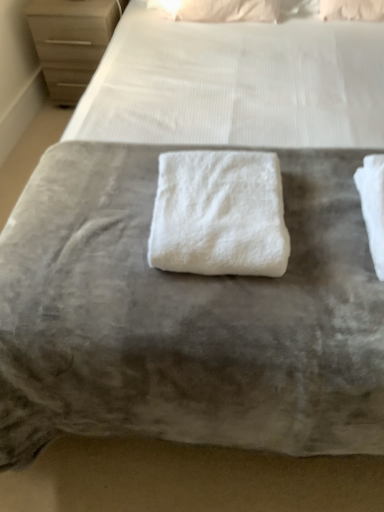
What are the coordinates of `matte wood chest of drawers at upper left` in the screenshot? It's located at (71, 41).

Identify the location of white fluffy towel at center. The height and width of the screenshot is (512, 384). (219, 214).

Measure the distance between point (289,240) and camera.

The depth of point (289,240) is 1.02 meters.

Where is `matte wood chest of drawers at upper left`? matte wood chest of drawers at upper left is located at coordinates (71, 41).

Are white fluffy towel at center and white soft pillow at upper center located far from each other?

white fluffy towel at center is far away from white soft pillow at upper center.

From a real-world perspective, between white fluffy towel at center and white soft pillow at upper center, who is vertically higher?

white fluffy towel at center, from a real-world perspective.

Consider the image. Can you confirm if white fluffy towel at center is wider than white soft pillow at upper center?

Indeed, white fluffy towel at center has a greater width compared to white soft pillow at upper center.

The image size is (384, 512). Find the location of `pillow behind the white fluffy towel at center`. pillow behind the white fluffy towel at center is located at coordinates (218, 10).

Is matte wood chest of drawers at upper left completely or partially inside white fluffy towel at center?

No, matte wood chest of drawers at upper left is not inside white fluffy towel at center.

Find the location of `chest of drawers above the white fluffy towel at center (from the image's perspective)`. chest of drawers above the white fluffy towel at center (from the image's perspective) is located at coordinates (71, 41).

From the image's perspective, which object appears higher, white soft pillow at upper center or matte wood chest of drawers at upper left?

white soft pillow at upper center appears higher in the image.

Can you tell me how much white soft pillow at upper center and matte wood chest of drawers at upper left differ in facing direction?

The angle between the facing direction of white soft pillow at upper center and the facing direction of matte wood chest of drawers at upper left is 7.36 degrees.

Is white soft pillow at upper center looking in the opposite direction of matte wood chest of drawers at upper left?

That's not correct — white soft pillow at upper center is not looking away from matte wood chest of drawers at upper left.

Is point (192, 20) closer to viewer compared to point (101, 28)?

Yes, point (192, 20) is closer to viewer.

Which is closer to the camera, (x=88, y=29) or (x=180, y=1)?

Point (x=180, y=1)

Considering the relative sizes of matte wood chest of drawers at upper left and white soft pillow at upper center in the image provided, is matte wood chest of drawers at upper left smaller than white soft pillow at upper center?

Actually, matte wood chest of drawers at upper left might be larger than white soft pillow at upper center.

Relative to white soft pillow at upper center, is matte wood chest of drawers at upper left in front or behind?

Visually, matte wood chest of drawers at upper left is located behind white soft pillow at upper center.

Based on the photo, are matte wood chest of drawers at upper left and white soft pillow at upper center making contact?

matte wood chest of drawers at upper left and white soft pillow at upper center are not in contact.

How many degrees apart are the facing directions of white soft pillow at upper center and white fluffy towel at center?

white soft pillow at upper center and white fluffy towel at center are facing 3.89 degrees away from each other.

From a real-world perspective, is white soft pillow at upper center located beneath white fluffy towel at center?

Yes.

Considering the positions of points (209, 7) and (243, 175), is point (209, 7) farther from camera compared to point (243, 175)?

Yes, point (209, 7) is farther from viewer.

Which object is further away from the camera, white soft pillow at upper center or white fluffy towel at center?

white soft pillow at upper center is behind.

From a real-world perspective, who is located lower, matte wood chest of drawers at upper left or white fluffy towel at center?

In real-world perspective, matte wood chest of drawers at upper left is lower.

Is point (58, 77) closer to viewer compared to point (160, 158)?

No, it is not.

Considering the sizes of matte wood chest of drawers at upper left and white fluffy towel at center in the image, is matte wood chest of drawers at upper left taller or shorter than white fluffy towel at center?

matte wood chest of drawers at upper left is taller than white fluffy towel at center.

Between matte wood chest of drawers at upper left and white fluffy towel at center, which one is positioned behind?

matte wood chest of drawers at upper left is more distant.

Locate an element on the screen. This screenshot has width=384, height=512. towel on the left of white soft pillow at upper center is located at coordinates (219, 214).

Where is `towel above the matte wood chest of drawers at upper left (from a real-world perspective)`? The image size is (384, 512). towel above the matte wood chest of drawers at upper left (from a real-world perspective) is located at coordinates (219, 214).

Considering their positions, is matte wood chest of drawers at upper left positioned further to white fluffy towel at center than white soft pillow at upper center?

Based on the image, matte wood chest of drawers at upper left appears to be further to white fluffy towel at center.

From the image, which object appears to be nearer to white soft pillow at upper center, white fluffy towel at center or matte wood chest of drawers at upper left?

matte wood chest of drawers at upper left is closer to white soft pillow at upper center.

Based on their spatial positions, is white soft pillow at upper center or white fluffy towel at center further from matte wood chest of drawers at upper left?

white fluffy towel at center lies further to matte wood chest of drawers at upper left than the other object.

Looking at the image, which one is located closer to white soft pillow at upper center, matte wood chest of drawers at upper left or white fluffy towel at center?

matte wood chest of drawers at upper left lies closer to white soft pillow at upper center than the other object.

When comparing their distances from matte wood chest of drawers at upper left, does white fluffy towel at center or white soft pillow at upper center seem closer?

white soft pillow at upper center is positioned closer to the anchor matte wood chest of drawers at upper left.

When comparing their distances from white fluffy towel at center, does white soft pillow at upper center or matte wood chest of drawers at upper left seem further?

matte wood chest of drawers at upper left lies further to white fluffy towel at center than the other object.

This screenshot has width=384, height=512. Identify the location of chest of drawers between white soft pillow at upper center and white fluffy towel at center in the up-down direction. (71, 41).